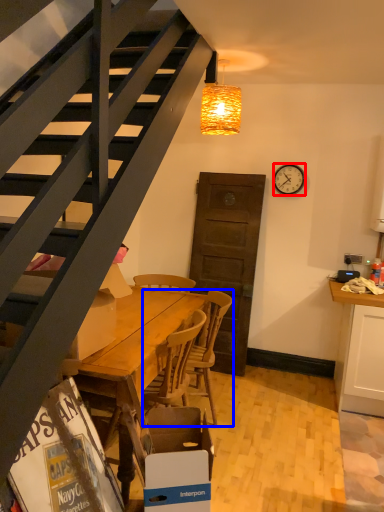
Question: Which of the following is the farthest to the observer, clock (highlighted by a red box) or chair (highlighted by a blue box)?

Choices:
 (A) clock
 (B) chair

Answer: (A)